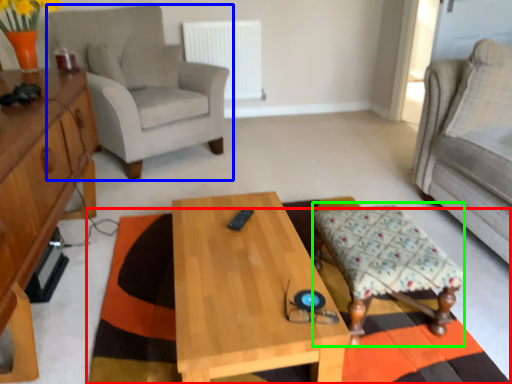
Question: Considering the real-world distances, which object is closest to mat (highlighted by a red box)? chair (highlighted by a blue box) or stool (highlighted by a green box).

Choices:
 (A) chair
 (B) stool

Answer: (B)